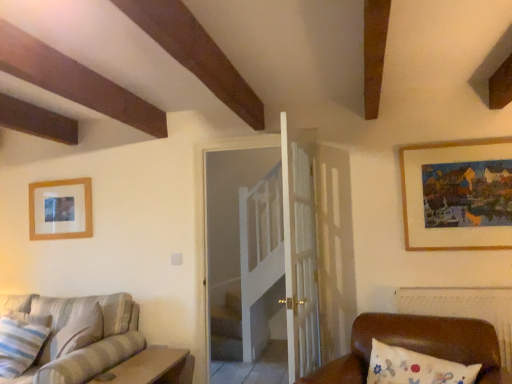
Question: Considering the positions of brown leather couch at lower right and striped fabric pillow at lower left in the image, is brown leather couch at lower right taller or shorter than striped fabric pillow at lower left?

Choices:
 (A) tall
 (B) short

Answer: (B)

Question: Considering the positions of point (504, 379) and point (6, 344), is point (504, 379) closer or farther from the camera than point (6, 344)?

Choices:
 (A) closer
 (B) farther

Answer: (A)

Question: Which of these objects is positioned farthest from the wooden table at lower left?

Choices:
 (A) striped fabric couch at lower left
 (B) brown leather couch at lower right
 (C) matte white picture frame at upper left, which is the second picture frame in right-to-left order
 (D) white wooden door at center
 (E) wooden framed painting at upper right, marked as the first picture frame in a front-to-back arrangement

Answer: (E)

Question: Which of these objects is positioned closest to the brown leather couch at lower right?

Choices:
 (A) wooden table at lower left
 (B) striped fabric couch at lower left
 (C) matte white picture frame at upper left, which appears as the 1th picture frame when viewed from the back
 (D) white wooden door at center
 (E) wooden framed painting at upper right, marked as the second picture frame in a left-to-right arrangement

Answer: (E)